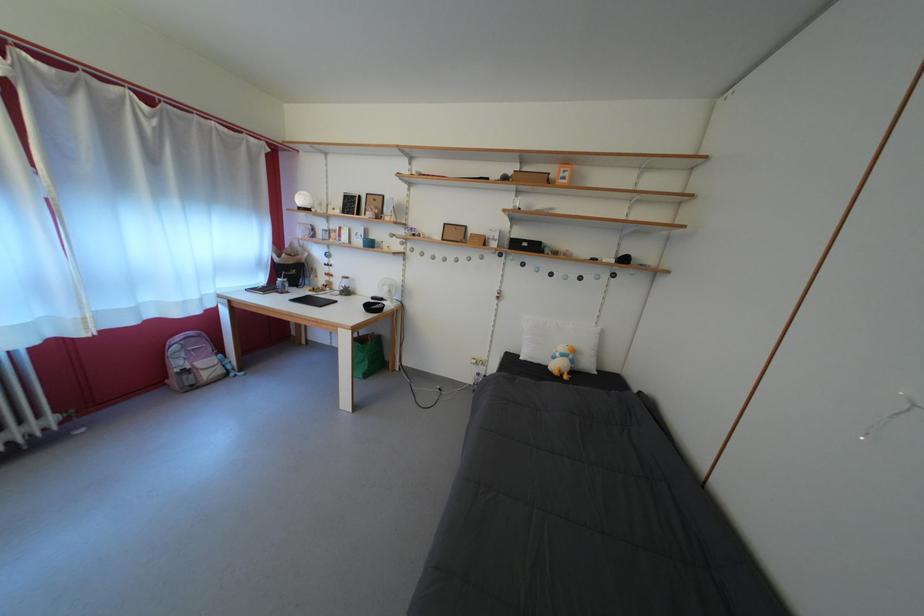
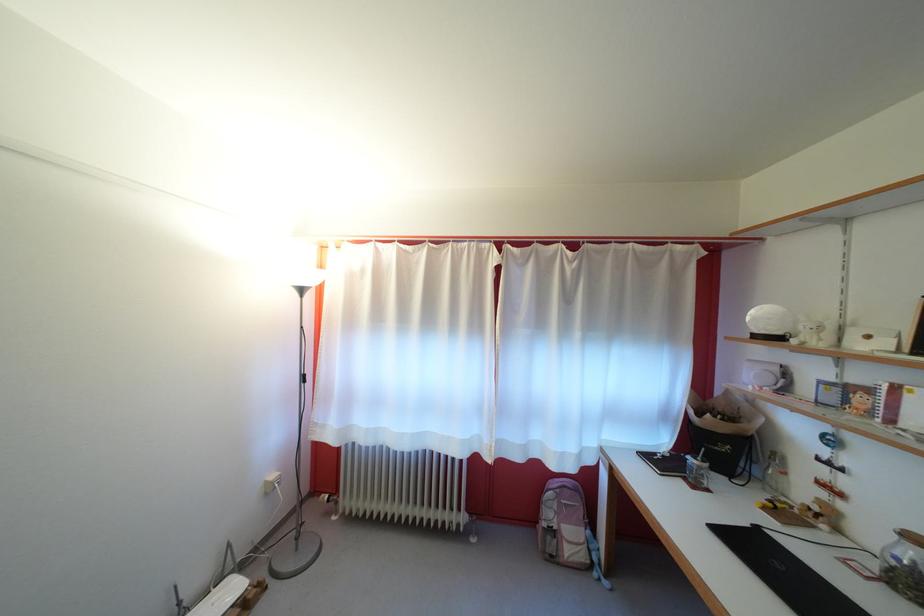
The point at (x=338, y=237) is marked in the first image. Where is the corresponding point in the second image?

(855, 395)